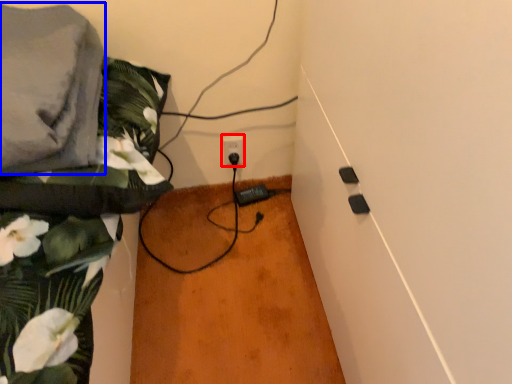
Question: Which of the following is the closest to the observer, power plugs and sockets (highlighted by a red box) or linen (highlighted by a blue box)?

Choices:
 (A) power plugs and sockets
 (B) linen

Answer: (B)